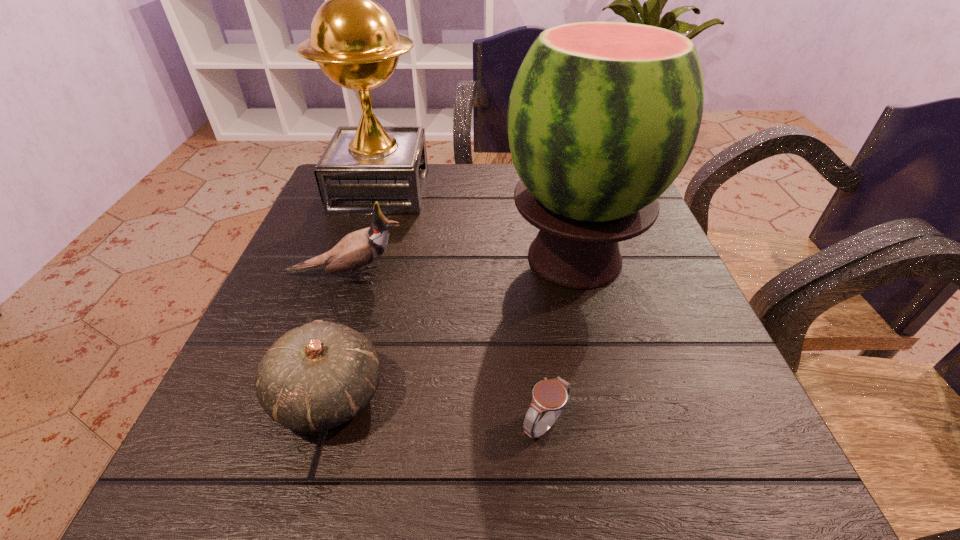
Find the location of a particular element. The width and height of the screenshot is (960, 540). the farthest object is located at coordinates (353, 39).

What are the coordinates of `watermelon` in the screenshot? It's located at (602, 117).

Identify the location of bird. The image size is (960, 540). (361, 248).

Locate an element on the screen. This screenshot has width=960, height=540. gourd is located at coordinates (316, 377).

Where is `the shortest object`? This screenshot has height=540, width=960. the shortest object is located at coordinates (551, 396).

The width and height of the screenshot is (960, 540). What are the coordinates of `vacant area situated on the front-facing side of the farthest object` in the screenshot? It's located at (492, 190).

Where is `vacant area situated 0.220m on the back of the watermelon`? The image size is (960, 540). vacant area situated 0.220m on the back of the watermelon is located at coordinates (553, 170).

In order to click on free space located at the face of the third tallest object in this screenshot , I will do pos(604,275).

Where is `vacant space located 0.190m on the right of the gourd`? This screenshot has height=540, width=960. vacant space located 0.190m on the right of the gourd is located at coordinates (513, 396).

Identify the location of free space located 0.060m on the back of the shortest object. The image size is (960, 540). (538, 369).